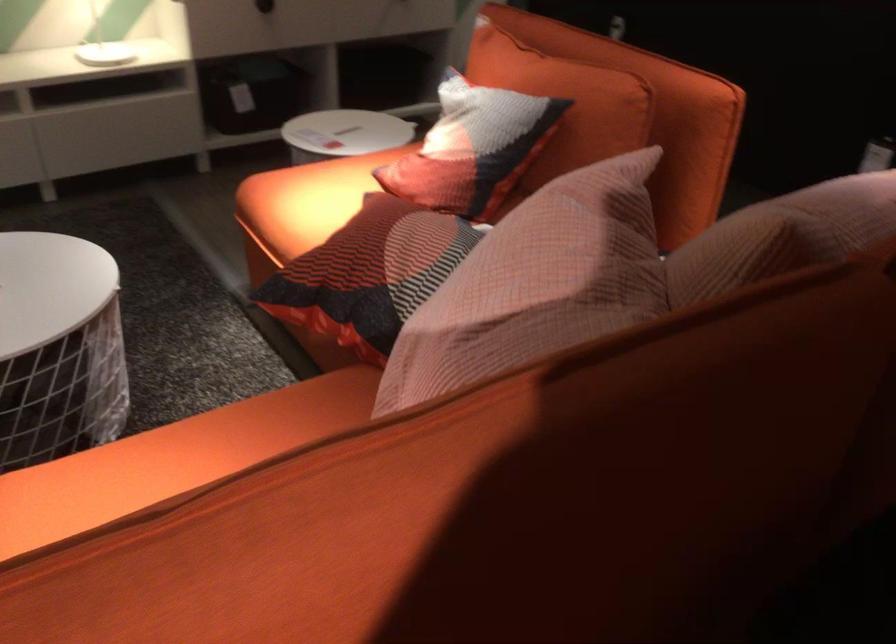
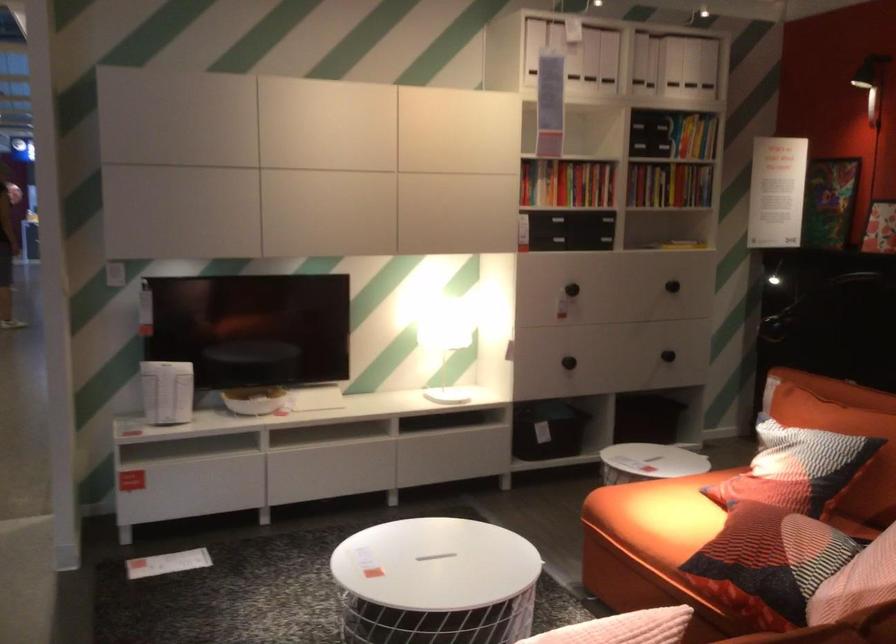
The images are taken continuously from a first-person perspective. In which direction are you moving?

The movement direction of the cameraman is left, backward.